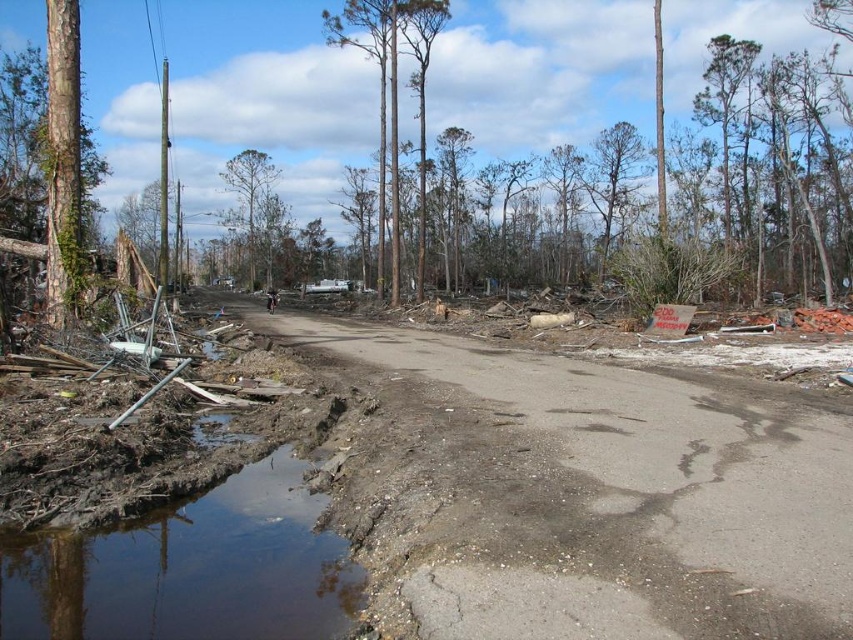
You are a rescue worker assessing the damage after a storm. You notice the muddy water at lower left and the brown rough tree at center. Which of these two objects has a smaller width?

The muddy water at lower left has a lesser width compared to the brown rough tree at center, so the muddy water at lower left is smaller in width.

You are a rescue worker trying to navigate through the damaged road. You need to locate the muddy water at lower left. Where exactly is it located in terms of coordinates?

The muddy water at lower left is located at point coordinates of (192, 570).